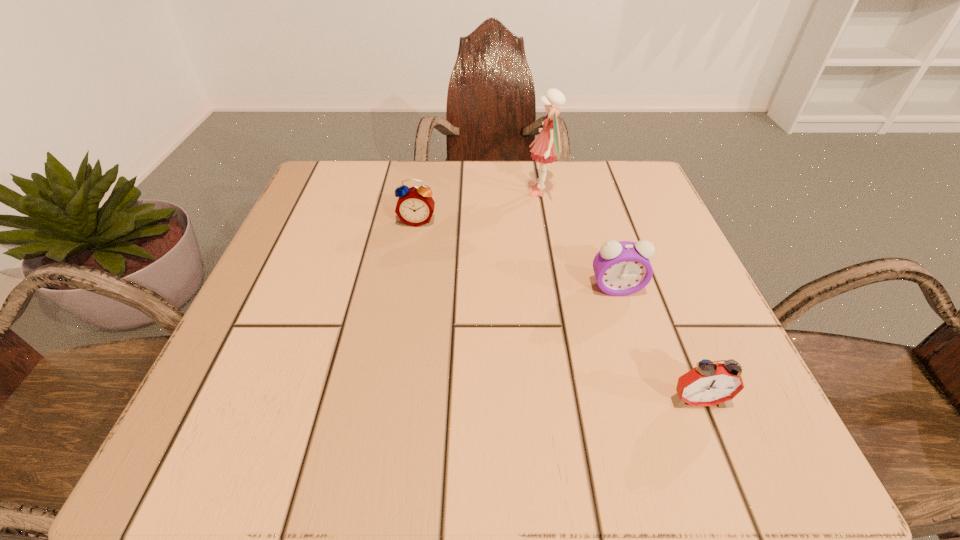
Where is `the tallest object`? This screenshot has height=540, width=960. the tallest object is located at coordinates [x=546, y=149].

Locate an element on the screen. Image resolution: width=960 pixels, height=540 pixels. doll is located at coordinates (546, 149).

Where is `the leftmost alarm clock`? The width and height of the screenshot is (960, 540). the leftmost alarm clock is located at coordinates (415, 206).

Where is `the third nearest object`? Image resolution: width=960 pixels, height=540 pixels. the third nearest object is located at coordinates (415, 206).

Locate an element on the screen. the second nearest alarm clock is located at coordinates tap(622, 268).

Image resolution: width=960 pixels, height=540 pixels. Identify the location of the nearest object. (708, 384).

Image resolution: width=960 pixels, height=540 pixels. I want to click on free space located on the front-facing side of the tallest object, so (x=456, y=193).

What are the coordinates of `free location located 0.360m on the front-facing side of the tallest object` in the screenshot? It's located at (358, 193).

You are a GUI agent. You are given a task and a screenshot of the screen. Output one action in this format:
    pyautogui.click(x=<x>, y=<y>)
    Task: Click on the vacant space located 0.380m on the front-facing side of the tallest object
    The height and width of the screenshot is (540, 960).
    Given the screenshot: What is the action you would take?
    pyautogui.click(x=348, y=193)

Find the location of a particular element. free location located 0.160m on the front-facing side of the leftmost object is located at coordinates (406, 286).